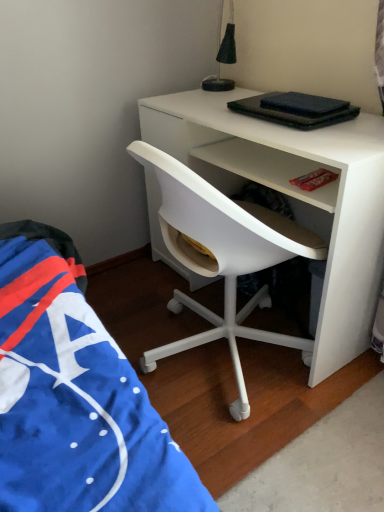
Question: Is white plastic chair at center not within black fabric lampshade at upper center?

Choices:
 (A) no
 (B) yes

Answer: (B)

Question: Is white plastic chair at center in contact with black fabric lampshade at upper center?

Choices:
 (A) no
 (B) yes

Answer: (A)

Question: Is white plastic chair at center positioned behind black fabric lampshade at upper center?

Choices:
 (A) no
 (B) yes

Answer: (A)

Question: Can you confirm if white plastic chair at center is wider than black fabric lampshade at upper center?

Choices:
 (A) yes
 (B) no

Answer: (A)

Question: Could you tell me if white plastic chair at center is facing black fabric lampshade at upper center?

Choices:
 (A) yes
 (B) no

Answer: (B)

Question: From the image's perspective, is white plastic chair at center above black fabric lampshade at upper center?

Choices:
 (A) no
 (B) yes

Answer: (A)

Question: Does black fabric lampshade at upper center have a greater height compared to white plastic chair at center?

Choices:
 (A) yes
 (B) no

Answer: (B)

Question: Does black fabric lampshade at upper center appear on the right side of white plastic chair at center?

Choices:
 (A) no
 (B) yes

Answer: (A)

Question: From a real-world perspective, is black fabric lampshade at upper center positioned under white plastic chair at center based on gravity?

Choices:
 (A) yes
 (B) no

Answer: (B)

Question: Does black fabric lampshade at upper center have a greater width compared to white plastic chair at center?

Choices:
 (A) no
 (B) yes

Answer: (A)

Question: Would you say white plastic chair at center is part of black fabric lampshade at upper center's contents?

Choices:
 (A) no
 (B) yes

Answer: (A)

Question: Could you tell me if black fabric lampshade at upper center is facing white plastic chair at center?

Choices:
 (A) no
 (B) yes

Answer: (A)

Question: Considering their positions, is white plastic chair at center located in front of or behind black fabric lampshade at upper center?

Choices:
 (A) front
 (B) behind

Answer: (A)